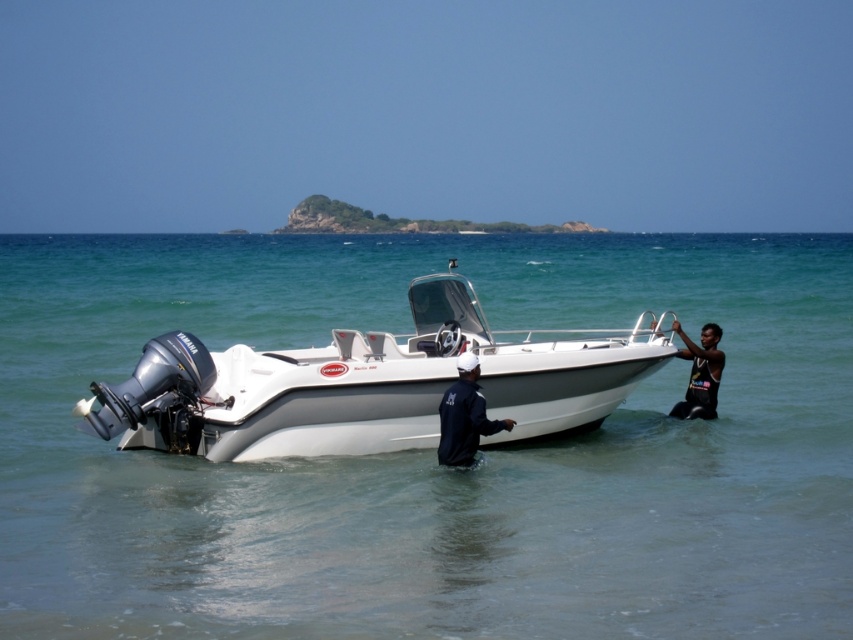
Question: Estimate the real-world distances between objects in this image. Which object is farther from the white glossy boat at center?

Choices:
 (A) black matte wetsuit at right
 (B) white glossy water at center
 (C) dark blue fabric jacket at center

Answer: (B)

Question: Does white glossy water at center have a lesser width compared to dark blue fabric jacket at center?

Choices:
 (A) no
 (B) yes

Answer: (A)

Question: Among these points, which one is farthest from the camera?

Choices:
 (A) (570, 385)
 (B) (705, 396)
 (C) (471, 461)
 (D) (193, 586)

Answer: (B)

Question: Is dark blue fabric jacket at center thinner than black matte wetsuit at right?

Choices:
 (A) yes
 (B) no

Answer: (B)

Question: Among these objects, which one is farthest from the camera?

Choices:
 (A) dark blue fabric jacket at center
 (B) black matte wetsuit at right
 (C) white glossy water at center
 (D) white glossy boat at center

Answer: (B)

Question: Can you confirm if white glossy water at center is positioned above white glossy boat at center?

Choices:
 (A) yes
 (B) no

Answer: (A)